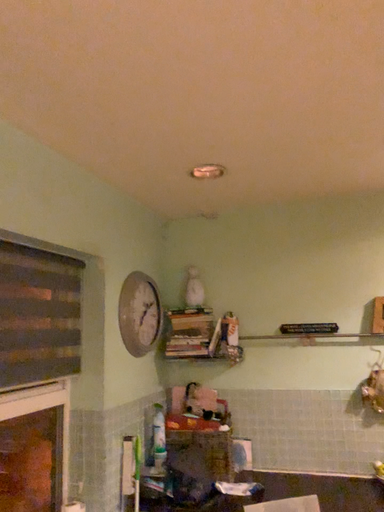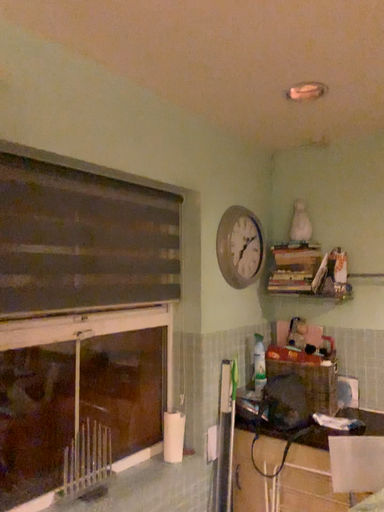
Question: Which way did the camera rotate in the video?

Choices:
 (A) rotated downward
 (B) rotated upward

Answer: (A)